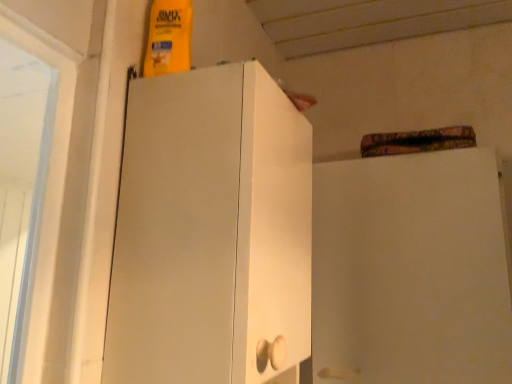
Question: Considering their positions, is white matte cabinet at upper right located in front of or behind white matte cabinet at left?

Choices:
 (A) behind
 (B) front

Answer: (A)

Question: Is point (321, 238) positioned closer to the camera than point (178, 294)?

Choices:
 (A) closer
 (B) farther

Answer: (B)

Question: Which is correct: white matte cabinet at upper right is inside white matte cabinet at left, or outside of it?

Choices:
 (A) inside
 (B) outside

Answer: (B)

Question: Looking at their shapes, would you say white matte cabinet at left is wider or thinner than white matte cabinet at upper right?

Choices:
 (A) thin
 (B) wide

Answer: (B)

Question: In the image, is white matte cabinet at left positioned in front of or behind white matte cabinet at upper right?

Choices:
 (A) behind
 (B) front

Answer: (B)

Question: Which is correct: white matte cabinet at left is inside white matte cabinet at upper right, or outside of it?

Choices:
 (A) outside
 (B) inside

Answer: (A)

Question: From the image's perspective, is white matte cabinet at left located above or below white matte cabinet at upper right?

Choices:
 (A) below
 (B) above

Answer: (B)